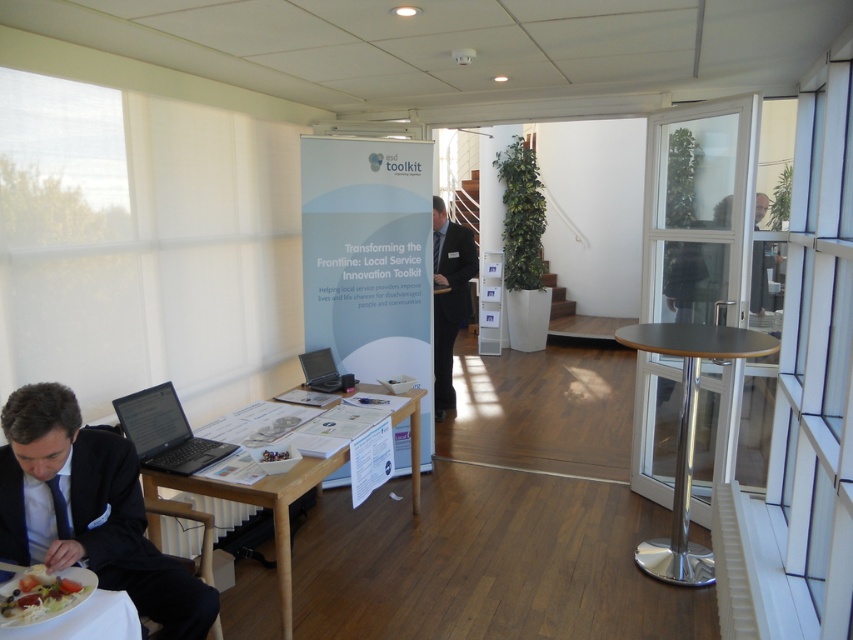
Question: In this image, where is black suit at lower left located relative to metallic gray table at right?

Choices:
 (A) left
 (B) right

Answer: (A)

Question: Estimate the real-world distances between objects in this image. Which object is farther from the white glossy plate at lower left?

Choices:
 (A) matte black laptop at lower left
 (B) black suit at lower left
 (C) light brown wooden table at lower left

Answer: (A)

Question: Which point is farther to the camera?

Choices:
 (A) light brown wooden table at lower left
 (B) white glossy plate at lower left
 (C) metallic gray table at right
 (D) black suit at lower left

Answer: (C)

Question: Which of the following is the farthest from the observer?

Choices:
 (A) (206, 460)
 (B) (323, 385)

Answer: (B)

Question: Is metallic gray table at right to the left of white glossy plate at lower left from the viewer's perspective?

Choices:
 (A) yes
 (B) no

Answer: (B)

Question: Does metallic gray table at right appear on the right side of matte black laptop at center?

Choices:
 (A) no
 (B) yes

Answer: (B)